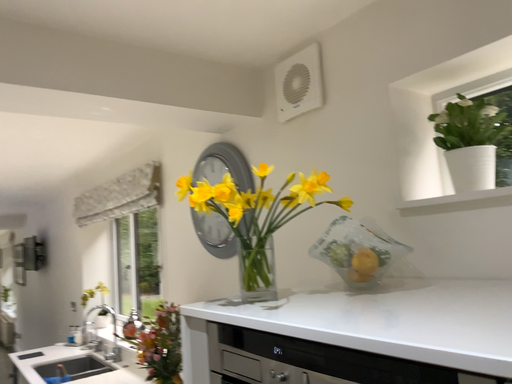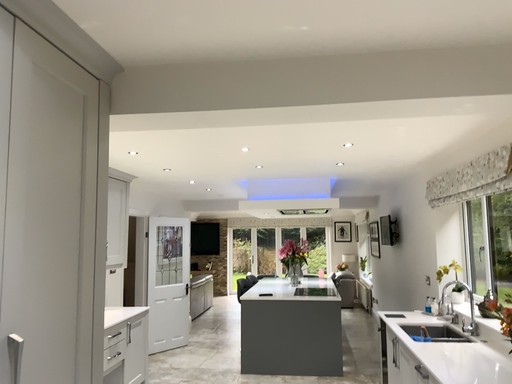
Question: How did the camera likely rotate when shooting the video?

Choices:
 (A) rotated left
 (B) rotated right

Answer: (A)